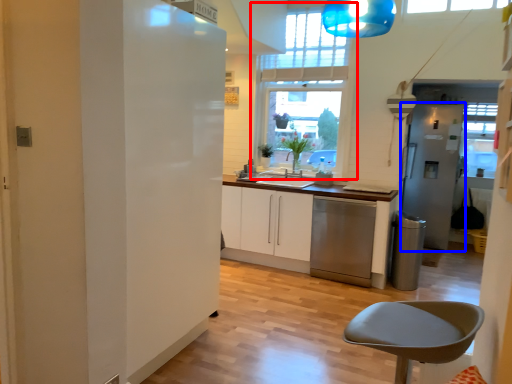
Question: Which of the following is the closest to the observer, window (highlighted by a red box) or fridge (highlighted by a blue box)?

Choices:
 (A) window
 (B) fridge

Answer: (A)